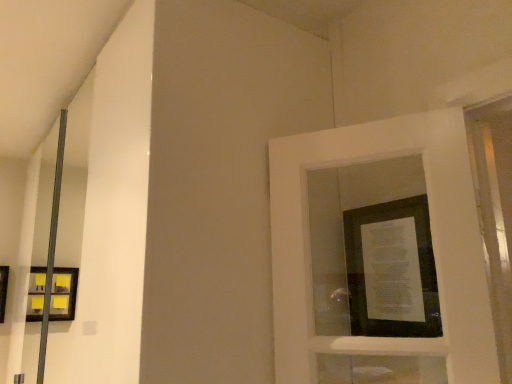
Question: Considering the relative sizes of matte black picture frame at left, which appears as the first picture frame when ordered from the bottom, and matte black picture frame at center, the first picture frame in the right-to-left sequence, in the image provided, is matte black picture frame at left, which appears as the first picture frame when ordered from the bottom, bigger than matte black picture frame at center, the first picture frame in the right-to-left sequence,?

Choices:
 (A) no
 (B) yes

Answer: (B)

Question: Is matte black picture frame at center, acting as the second picture frame starting from the back, inside matte black picture frame at left, the 2th picture frame from the front?

Choices:
 (A) yes
 (B) no

Answer: (B)

Question: From a real-world perspective, is matte black picture frame at left, which ranks as the 2th picture frame in top-to-bottom order, on matte black picture frame at center, which appears as the 1th picture frame when viewed from the front?

Choices:
 (A) yes
 (B) no

Answer: (B)

Question: Is matte black picture frame at center, acting as the second picture frame starting from the back, at the back of matte black picture frame at left, which appears as the first picture frame when ordered from the bottom?

Choices:
 (A) yes
 (B) no

Answer: (B)

Question: Does matte black picture frame at left, which appears as the first picture frame when viewed from the back, have a greater width compared to matte black picture frame at center, the first picture frame in the right-to-left sequence?

Choices:
 (A) no
 (B) yes

Answer: (B)

Question: Considering the relative positions of matte black picture frame at left, the 2th picture frame from the front, and matte black picture frame at center, acting as the second picture frame starting from the back, in the image provided, is matte black picture frame at left, the 2th picture frame from the front, to the right of matte black picture frame at center, acting as the second picture frame starting from the back, from the viewer's perspective?

Choices:
 (A) no
 (B) yes

Answer: (A)

Question: Can you confirm if matte black picture frame at center, the first picture frame in the right-to-left sequence, is positioned to the right of matte black picture frame at left, which ranks as the 2th picture frame in top-to-bottom order?

Choices:
 (A) no
 (B) yes

Answer: (B)

Question: Considering the relative sizes of matte black picture frame at center, acting as the second picture frame starting from the back, and matte black picture frame at left, which appears as the first picture frame when viewed from the back, in the image provided, is matte black picture frame at center, acting as the second picture frame starting from the back, taller than matte black picture frame at left, which appears as the first picture frame when viewed from the back,?

Choices:
 (A) yes
 (B) no

Answer: (A)

Question: Is matte black picture frame at center, which appears as the 1th picture frame when viewed from the top, next to matte black picture frame at left, the 2th picture frame from the front?

Choices:
 (A) yes
 (B) no

Answer: (B)

Question: Does matte black picture frame at center, which appears as the 1th picture frame when viewed from the top, have a smaller size compared to matte black picture frame at left, which ranks as the 2th picture frame in top-to-bottom order?

Choices:
 (A) yes
 (B) no

Answer: (A)

Question: Is the position of matte black picture frame at center, which appears as the 1th picture frame when viewed from the top, less distant than that of matte black picture frame at left, which is counted as the first picture frame, starting from the left?

Choices:
 (A) yes
 (B) no

Answer: (A)

Question: From the image's perspective, would you say matte black picture frame at center, which is the 2th picture frame in bottom-to-top order, is shown under matte black picture frame at left, the 2th picture frame from the front?

Choices:
 (A) no
 (B) yes

Answer: (A)

Question: Does point (380, 206) appear closer or farther from the camera than point (1, 299)?

Choices:
 (A) farther
 (B) closer

Answer: (B)